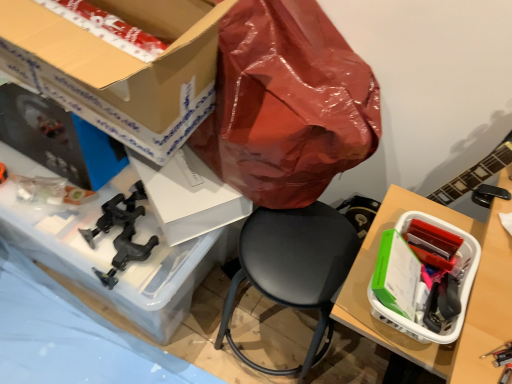
Question: Can you confirm if white plastic basket at right, which is the 2th box in top-to-bottom order, is wider than cardboard box at upper left, which is counted as the 2th box, starting from the right?

Choices:
 (A) yes
 (B) no

Answer: (B)

Question: From the image's perspective, is white plastic basket at right, the first box when ordered from right to left, above cardboard box at upper left, the 1th box viewed from the left?

Choices:
 (A) no
 (B) yes

Answer: (A)

Question: Can you confirm if white plastic basket at right, which is the 2th box in top-to-bottom order, is taller than cardboard box at upper left, arranged as the 2th box when ordered from the bottom?

Choices:
 (A) yes
 (B) no

Answer: (B)

Question: Is white plastic basket at right, which is counted as the 2th box, starting from the left, facing towards cardboard box at upper left, which is counted as the 2th box, starting from the right?

Choices:
 (A) yes
 (B) no

Answer: (B)

Question: Is white plastic basket at right, the first box when ordered from right to left, positioned in front of cardboard box at upper left, the 1th box viewed from the left?

Choices:
 (A) yes
 (B) no

Answer: (B)

Question: Considering the relative positions of white plastic basket at right, which is counted as the 2th box, starting from the left, and cardboard box at upper left, which is the first box in top-to-bottom order, in the image provided, is white plastic basket at right, which is counted as the 2th box, starting from the left, to the left or to the right of cardboard box at upper left, which is the first box in top-to-bottom order,?

Choices:
 (A) left
 (B) right

Answer: (B)

Question: In the image, is white plastic basket at right, which is the 2th box in top-to-bottom order, positioned in front of or behind cardboard box at upper left, the 1th box viewed from the left?

Choices:
 (A) behind
 (B) front

Answer: (A)

Question: Is white plastic basket at right, which is counted as the 2th box, starting from the left, taller or shorter than cardboard box at upper left, arranged as the 2th box when ordered from the bottom?

Choices:
 (A) tall
 (B) short

Answer: (B)

Question: From the image's perspective, is white plastic basket at right, the first box when ordered from right to left, above or below cardboard box at upper left, the 1th box viewed from the left?

Choices:
 (A) below
 (B) above

Answer: (A)

Question: Considering the positions of clear plastic container at lower left and cardboard box at upper left, arranged as the 2th box when ordered from the bottom, in the image, is clear plastic container at lower left taller or shorter than cardboard box at upper left, arranged as the 2th box when ordered from the bottom,?

Choices:
 (A) short
 (B) tall

Answer: (A)

Question: Is clear plastic container at lower left inside or outside of cardboard box at upper left, which is the first box in top-to-bottom order?

Choices:
 (A) outside
 (B) inside

Answer: (A)

Question: From the image's perspective, is clear plastic container at lower left above or below cardboard box at upper left, arranged as the 2th box when ordered from the bottom?

Choices:
 (A) below
 (B) above

Answer: (A)

Question: In the image, is clear plastic container at lower left positioned in front of or behind cardboard box at upper left, which is the first box in top-to-bottom order?

Choices:
 (A) front
 (B) behind

Answer: (B)

Question: Looking at their shapes, would you say cardboard box at upper left, the 1th box viewed from the left, is wider or thinner than white plastic basket at right, which is the 2th box in top-to-bottom order?

Choices:
 (A) wide
 (B) thin

Answer: (A)

Question: In terms of height, does cardboard box at upper left, which is counted as the 2th box, starting from the right, look taller or shorter compared to white plastic basket at right, the 1th box positioned from the bottom?

Choices:
 (A) tall
 (B) short

Answer: (A)